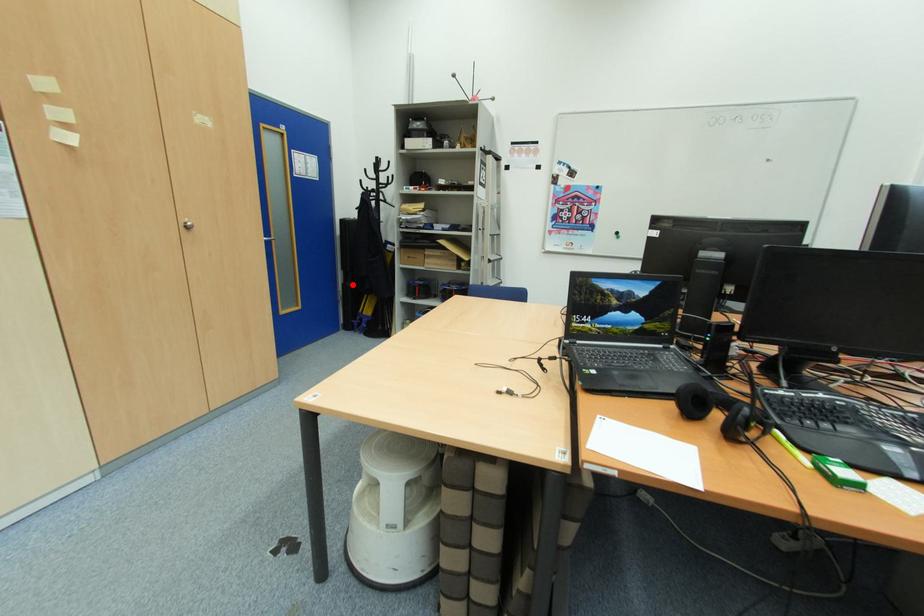
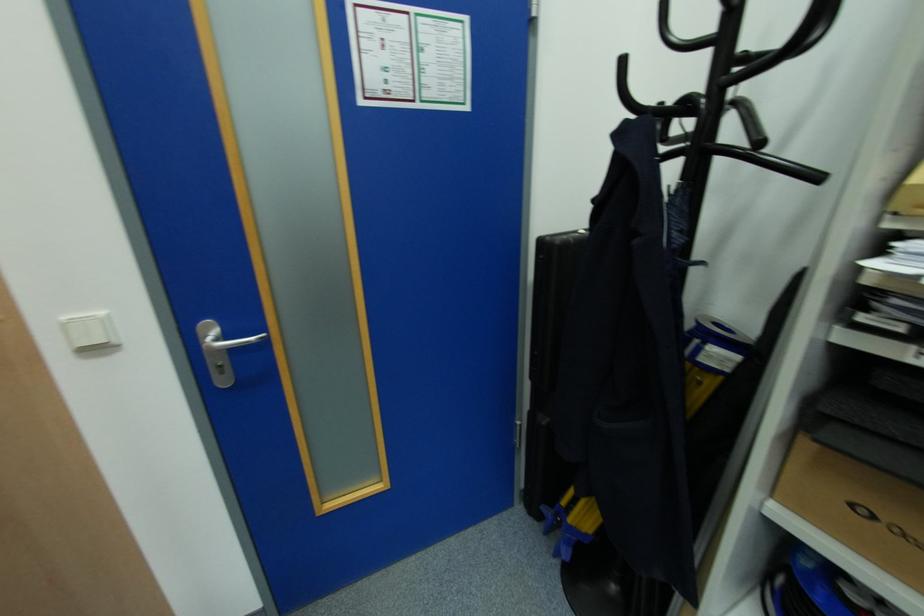
Question: A red point is marked in image1. In image2, is the corresponding 3D point closer to the camera or farther? Reply with the corresponding letter.

Choices:
 (A) The corresponding 3D point is closer.
 (B) The corresponding 3D point is farther.

Answer: (B)